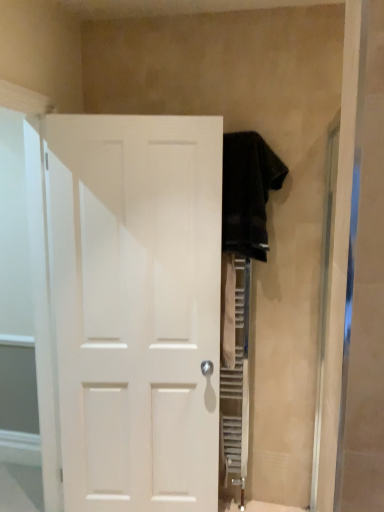
Question: From a real-world perspective, is dark brown towel at upper right physically located above or below transparent glass door at left?

Choices:
 (A) above
 (B) below

Answer: (A)

Question: From the image's perspective, is dark brown towel at upper right above or below transparent glass door at left?

Choices:
 (A) below
 (B) above

Answer: (B)

Question: Which of these objects is positioned farthest from the transparent glass door at left?

Choices:
 (A) white matte door at center
 (B) dark brown towel at upper right

Answer: (B)

Question: Estimate the real-world distances between objects in this image. Which object is closer to the white matte door at center?

Choices:
 (A) transparent glass door at left
 (B) dark brown towel at upper right

Answer: (A)